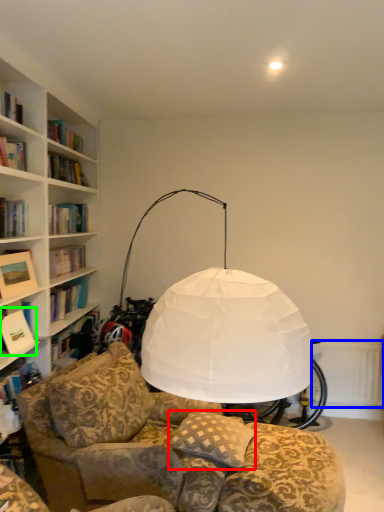
Question: Considering the real-world distances, which object is farthest from pillow (highlighted by a red box)? radiator (highlighted by a blue box) or book (highlighted by a green box)?

Choices:
 (A) radiator
 (B) book

Answer: (A)